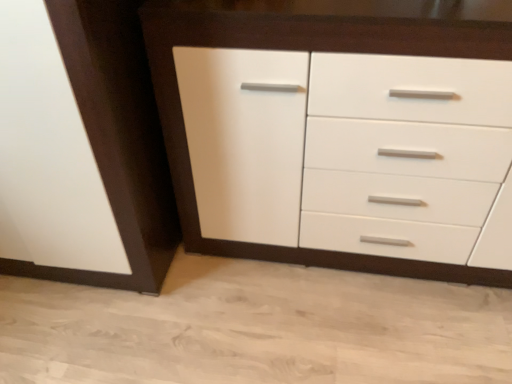
What do you see at coordinates (308, 50) in the screenshot?
I see `white glossy cabinet at center` at bounding box center [308, 50].

What are the coordinates of `white glossy cabinet at center` in the screenshot? It's located at (308, 50).

This screenshot has height=384, width=512. Identify the location of white glossy cabinet at center. (308, 50).